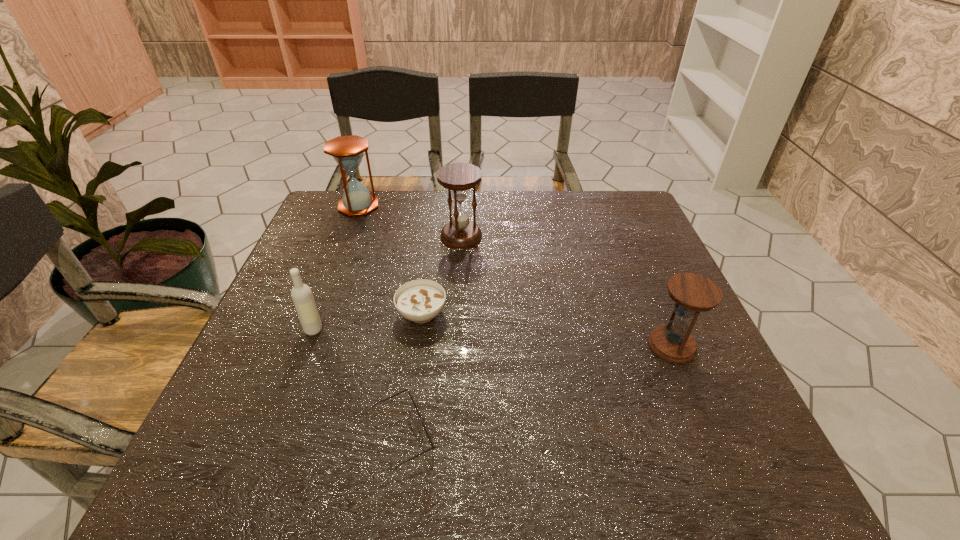
Where is `vacant space located 0.150m on the right of the farthest object`? vacant space located 0.150m on the right of the farthest object is located at coordinates (428, 206).

I want to click on vacant space situated on the front of the second hourglass from right to left, so click(459, 275).

This screenshot has height=540, width=960. Find the location of `vacant region located on the right of the vodka`. vacant region located on the right of the vodka is located at coordinates (502, 329).

I want to click on vacant area situated 0.130m on the left of the nearest hourglass, so click(587, 345).

Where is `free location located 0.100m on the front of the soup bowl`? free location located 0.100m on the front of the soup bowl is located at coordinates (414, 370).

In order to click on free spot located with the lenses facing outward on the shortest object in this screenshot , I will do `click(544, 435)`.

Image resolution: width=960 pixels, height=540 pixels. I want to click on object that is at the near edge, so click(426, 431).

Where is `hourglass that is at the left edge`? hourglass that is at the left edge is located at coordinates (347, 151).

Where is `vodka present at the left edge`? This screenshot has height=540, width=960. vodka present at the left edge is located at coordinates pyautogui.click(x=301, y=294).

Image resolution: width=960 pixels, height=540 pixels. What are the coordinates of `object that is at the right edge` in the screenshot? It's located at (692, 293).